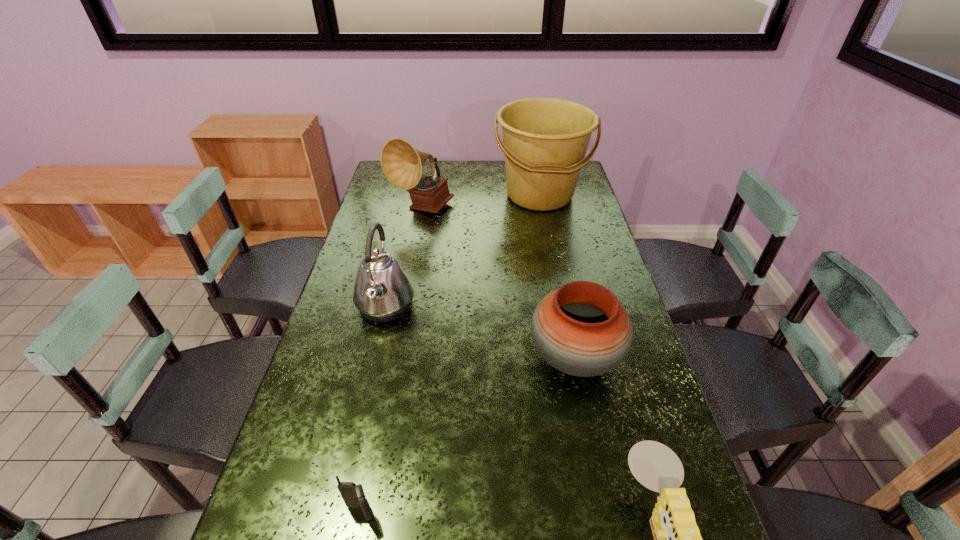
Identify the location of phonograph record situated at the left edge. (402, 164).

Locate an element on the screen. This screenshot has width=960, height=540. kettle situated at the left edge is located at coordinates (383, 292).

At what (x,y) coordinates should I click in order to perform the action: click on bucket that is at the right edge. Please return your answer as a coordinate pair (x, y). This screenshot has height=540, width=960. Looking at the image, I should click on (545, 140).

You are a GUI agent. You are given a task and a screenshot of the screen. Output one action in this format:
    pyautogui.click(x=<x>, y=<y>)
    Task: Click on the pottery present at the right edge
    
    Given the screenshot: What is the action you would take?
    pyautogui.click(x=581, y=329)

At what (x,y) coordinates should I click in order to perform the action: click on object located in the far right corner section of the desktop. Please return your answer as a coordinate pair (x, y). The image size is (960, 540). Looking at the image, I should click on (545, 140).

The width and height of the screenshot is (960, 540). Identify the location of free space at the far edge of the desktop. (475, 185).

Where is `vacant region at the right edge of the desktop`? The height and width of the screenshot is (540, 960). vacant region at the right edge of the desktop is located at coordinates (616, 451).

The width and height of the screenshot is (960, 540). I want to click on free space between the bucket and the kettle, so click(x=463, y=251).

Identify the location of vacant space that is in between the phonograph record and the pottery. (498, 284).

Identify the location of vacant area between the phonograph record and the kettle. Image resolution: width=960 pixels, height=540 pixels. (403, 258).